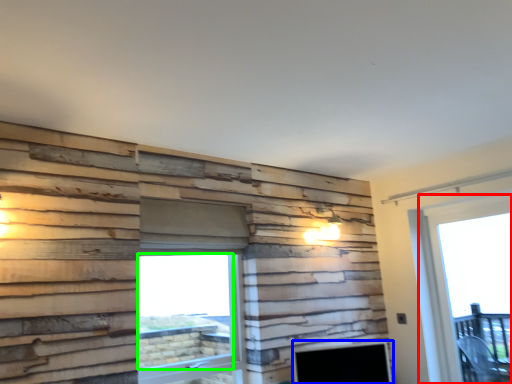
Question: Estimate the real-world distances between objects in this image. Which object is closer to window (highlighted by a red box), fireplace (highlighted by a blue box) or window screen (highlighted by a green box)?

Choices:
 (A) fireplace
 (B) window screen

Answer: (A)